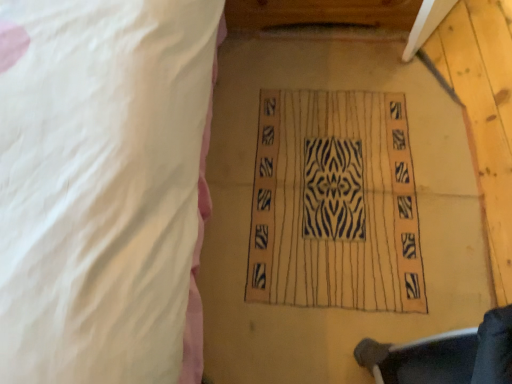
The width and height of the screenshot is (512, 384). I want to click on free location to the right of zebra-patterned fabric at center, so click(x=455, y=158).